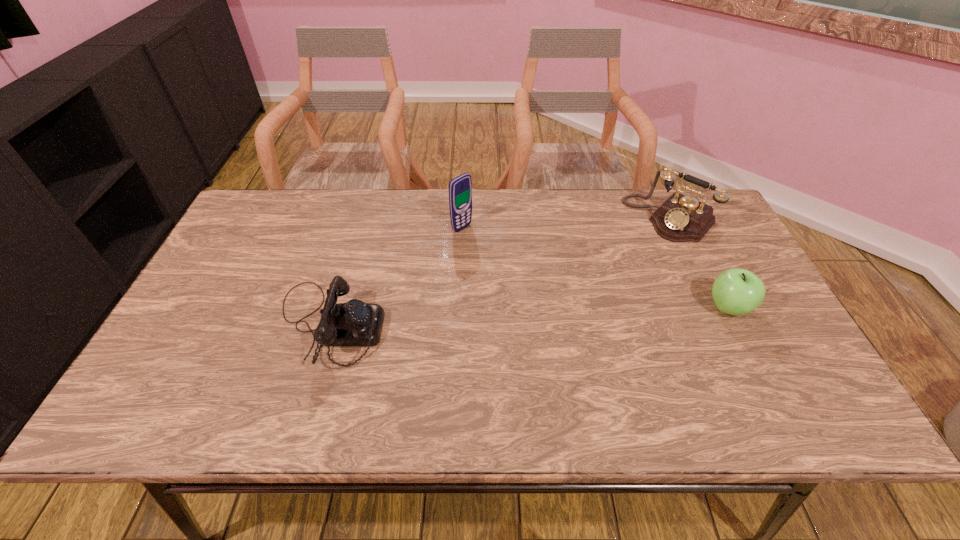
I want to click on the nearer telephone, so click(354, 323).

The height and width of the screenshot is (540, 960). Find the location of `the leftmost object`. the leftmost object is located at coordinates (354, 323).

Where is `apple`? The width and height of the screenshot is (960, 540). apple is located at coordinates pos(736,291).

Where is `cellular telephone`? cellular telephone is located at coordinates (460, 188).

Locate an element on the screen. Image resolution: width=960 pixels, height=540 pixels. the farther telephone is located at coordinates (680, 218).

The image size is (960, 540). What are the coordinates of `the right telephone` in the screenshot? It's located at (680, 218).

Identify the location of blank space located 0.070m on the front-facing side of the shorter telephone. The height and width of the screenshot is (540, 960). pyautogui.click(x=412, y=325).

Image resolution: width=960 pixels, height=540 pixels. Identify the location of blank space located 0.050m on the back of the apple. (713, 278).

Identify the location of vacant space located 0.170m on the front-facing side of the cellular telephone. (511, 260).

You are a GUI agent. You are given a task and a screenshot of the screen. Output one action in this format:
    pyautogui.click(x=<x>, y=<y>)
    Task: Click on the free space located on the front-facing side of the cellular telephone
    The width and height of the screenshot is (960, 540).
    Given the screenshot: What is the action you would take?
    pyautogui.click(x=521, y=268)